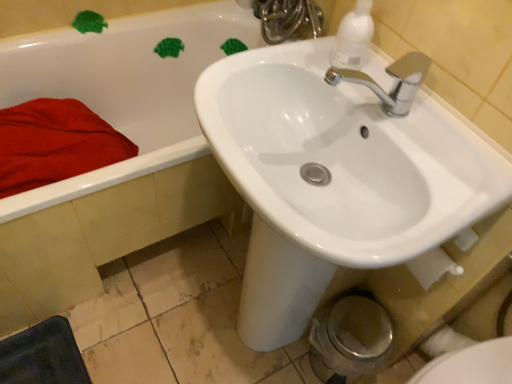
Question: Is red soft towel at left positioned with its back to white plastic soap dispenser at upper right?

Choices:
 (A) yes
 (B) no

Answer: (B)

Question: Is red soft towel at left wider than white plastic soap dispenser at upper right?

Choices:
 (A) yes
 (B) no

Answer: (A)

Question: Is red soft towel at left not near white plastic soap dispenser at upper right?

Choices:
 (A) no
 (B) yes

Answer: (A)

Question: From a real-world perspective, is red soft towel at left located higher than white plastic soap dispenser at upper right?

Choices:
 (A) no
 (B) yes

Answer: (A)

Question: Is red soft towel at left at the left side of white plastic soap dispenser at upper right?

Choices:
 (A) yes
 (B) no

Answer: (A)

Question: From the image's perspective, is red soft towel at left located beneath white plastic soap dispenser at upper right?

Choices:
 (A) no
 (B) yes

Answer: (B)

Question: Can you confirm if white glossy bidet at lower right is bigger than white glossy faucet at upper center?

Choices:
 (A) no
 (B) yes

Answer: (B)

Question: Is white glossy bidet at lower right at the right side of white glossy faucet at upper center?

Choices:
 (A) no
 (B) yes

Answer: (B)

Question: Does white glossy bidet at lower right have a lesser height compared to white glossy faucet at upper center?

Choices:
 (A) yes
 (B) no

Answer: (B)

Question: Can you confirm if white glossy bidet at lower right is positioned to the left of white glossy faucet at upper center?

Choices:
 (A) yes
 (B) no

Answer: (B)

Question: Is white glossy bidet at lower right closer to camera compared to white glossy faucet at upper center?

Choices:
 (A) no
 (B) yes

Answer: (B)

Question: Is there a large distance between white glossy bidet at lower right and white glossy faucet at upper center?

Choices:
 (A) yes
 (B) no

Answer: (A)

Question: Is white glossy sink at upper center at the right side of white glossy faucet at upper center?

Choices:
 (A) no
 (B) yes

Answer: (A)